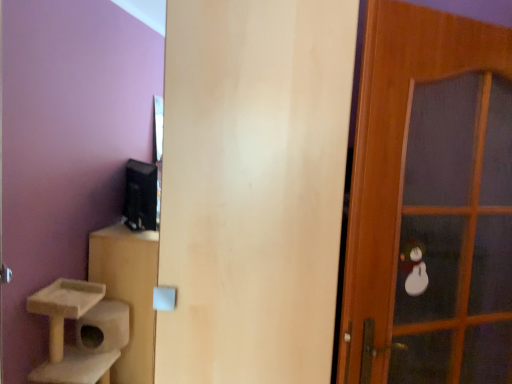
Question: From a real-world perspective, is matte wood door at center, acting as the first door starting from the left, positioned above or below wooden door at right, which is counted as the first door, starting from the right?

Choices:
 (A) above
 (B) below

Answer: (B)

Question: Is point (234, 72) closer or farther from the camera than point (413, 289)?

Choices:
 (A) closer
 (B) farther

Answer: (A)

Question: In terms of height, does matte wood door at center, acting as the first door starting from the left, look taller or shorter compared to wooden door at right, positioned as the 2th door in left-to-right order?

Choices:
 (A) tall
 (B) short

Answer: (A)

Question: Considering their positions, is wooden door at right, which is counted as the first door, starting from the right, located in front of or behind matte wood door at center, which appears as the 2th door when viewed from the right?

Choices:
 (A) front
 (B) behind

Answer: (B)

Question: Is wooden door at right, which is counted as the first door, starting from the right, taller or shorter than matte wood door at center, acting as the first door starting from the left?

Choices:
 (A) tall
 (B) short

Answer: (B)

Question: Do you think wooden door at right, which is counted as the first door, starting from the right, is within matte wood door at center, which appears as the 2th door when viewed from the right, or outside of it?

Choices:
 (A) outside
 (B) inside

Answer: (A)

Question: Considering the positions of point click(x=465, y=56) and point click(x=245, y=46), is point click(x=465, y=56) closer or farther from the camera than point click(x=245, y=46)?

Choices:
 (A) closer
 (B) farther

Answer: (B)